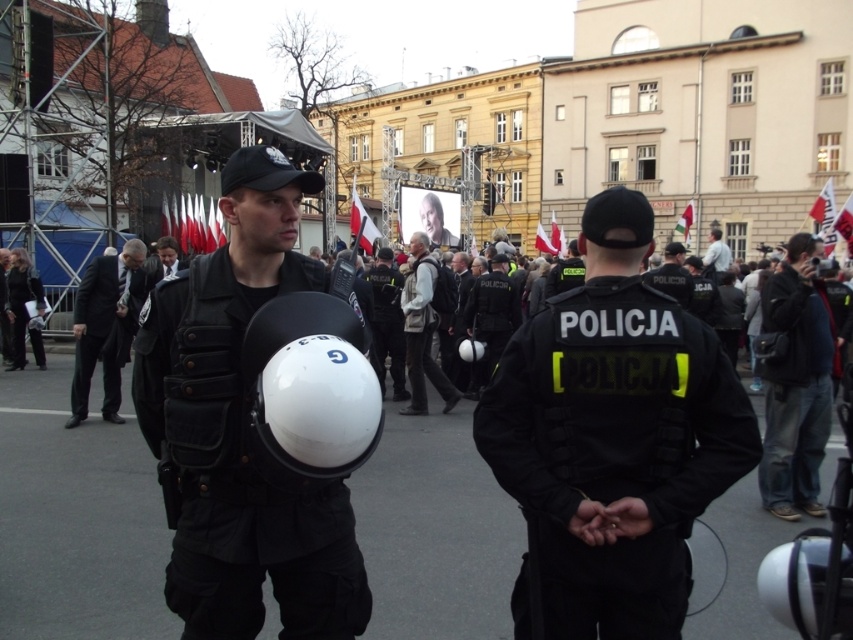
Who is more distant from viewer, (x=310, y=435) or (x=410, y=394)?

Positioned behind is point (x=410, y=394).

In the scene shown: Can you confirm if white matte helmet at center is positioned to the left of light gray fabric jacket at center?

Yes, white matte helmet at center is to the left of light gray fabric jacket at center.

Between point (305, 392) and point (403, 301), which one is positioned in front?

Point (305, 392)

At what (x,y) coordinates should I click in order to perform the action: click on white matte helmet at center. Please return your answer as a coordinate pair (x, y). Image resolution: width=853 pixels, height=640 pixels. Looking at the image, I should click on (308, 390).

What are the coordinates of `black matte uniform at center` in the screenshot? It's located at (611, 440).

Who is more distant from viewer, [660,538] or [401,346]?

The point [401,346] is behind.

Locate an element on the screen. black matte uniform at center is located at coordinates point(611,440).

Is matte black helmet at center shorter than dark blue jeans at center?

In fact, matte black helmet at center may be taller than dark blue jeans at center.

Is point (166, 305) closer to camera compared to point (779, 449)?

Yes, point (166, 305) is closer to viewer.

Is point (178, 524) positioned before point (807, 472)?

Yes, it is in front of point (807, 472).

Identify the location of matte black helmet at center. The width and height of the screenshot is (853, 640). (241, 432).